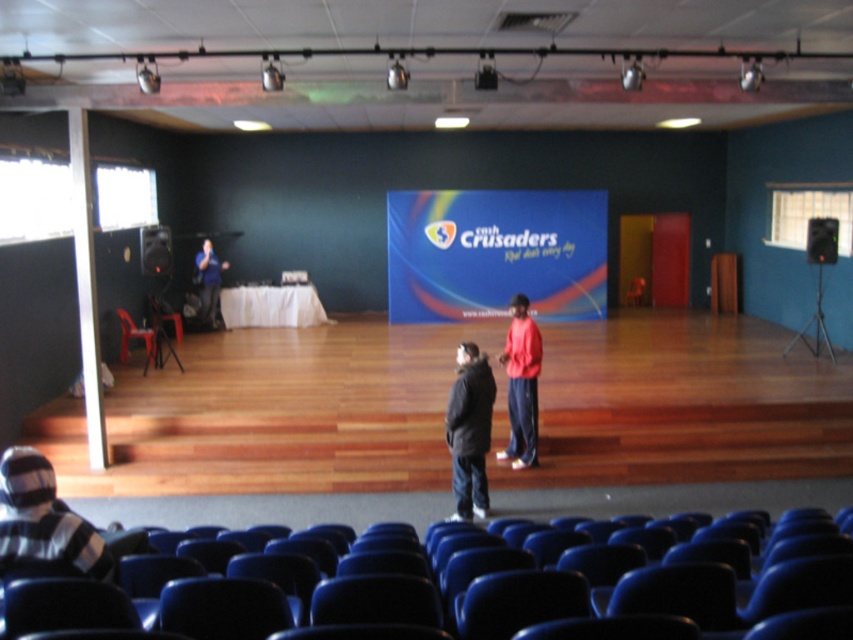
Looking at this image, does striped knit hat at lower left have a smaller size compared to matte red shirt at center?

Yes, striped knit hat at lower left is smaller than matte red shirt at center.

Measure the distance between point (85,570) and camera.

Point (85,570) is 10.53 feet from camera.

Where is `striped knit hat at lower left`? The width and height of the screenshot is (853, 640). striped knit hat at lower left is located at coordinates (44, 518).

Is matte red shirt at center taller than matte black shirt at left?

Correct, matte red shirt at center is much taller as matte black shirt at left.

Who is positioned more to the right, matte red shirt at center or matte black shirt at left?

From the viewer's perspective, matte red shirt at center appears more on the right side.

You are a GUI agent. You are given a task and a screenshot of the screen. Output one action in this format:
    pyautogui.click(x=<x>, y=<y>)
    Task: Click on the matte red shirt at center
    The image size is (853, 640).
    Given the screenshot: What is the action you would take?
    pyautogui.click(x=521, y=385)

The image size is (853, 640). Find the location of `matte red shirt at center`. matte red shirt at center is located at coordinates (521, 385).

Is blue fabric screen at center to the right of black matte jacket at center from the viewer's perspective?

Correct, you'll find blue fabric screen at center to the right of black matte jacket at center.

In order to click on blue fabric screen at center in this screenshot , I will do `click(495, 253)`.

At what (x,y) coordinates should I click in order to perform the action: click on blue fabric screen at center. Please return your answer as a coordinate pair (x, y). The image size is (853, 640). Looking at the image, I should click on (495, 253).